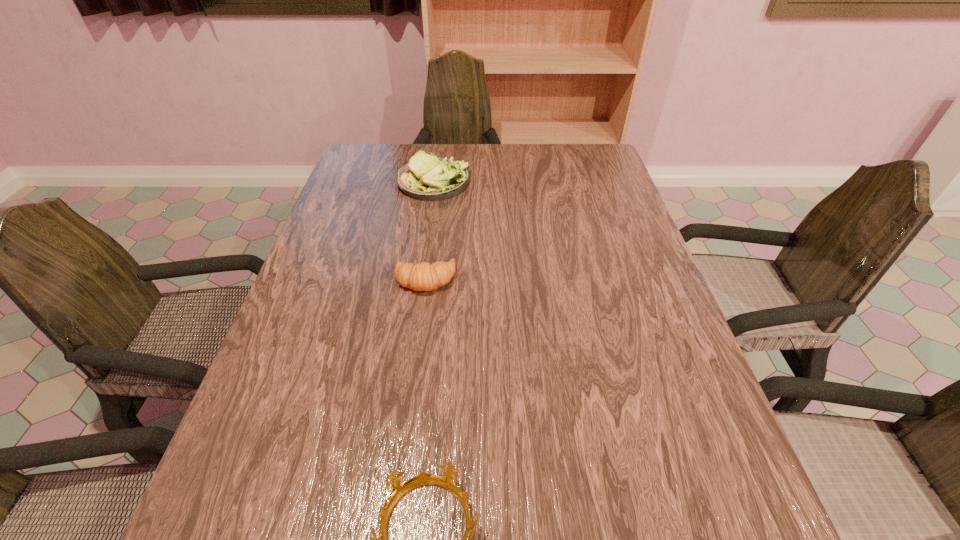
The image size is (960, 540). Identify the location of the farthest object. (426, 177).

Where is `lettuce`? lettuce is located at coordinates (426, 177).

You are a GUI agent. You are given a task and a screenshot of the screen. Output one action in this format:
    pyautogui.click(x=<x>, y=<y>)
    Task: Click on the crescent roll
    
    Given the screenshot: What is the action you would take?
    pyautogui.click(x=422, y=276)

This screenshot has height=540, width=960. In order to click on free space located 0.250m on the front of the farthest object in this screenshot , I will do `click(421, 260)`.

Locate an element on the screen. free space located on the back of the second nearest object is located at coordinates (434, 208).

Where is `object present at the far edge`? Image resolution: width=960 pixels, height=540 pixels. object present at the far edge is located at coordinates (426, 177).

In the image, there is a desktop. What are the coordinates of `vacant area at the far edge` in the screenshot? It's located at (524, 180).

What are the coordinates of `free region at the near edge of the desktop` in the screenshot? It's located at (538, 531).

Where is `free space at the left edge`? free space at the left edge is located at coordinates (262, 386).

In the image, there is a desktop. Identify the location of vacant space at the right edge. The image size is (960, 540). (684, 490).